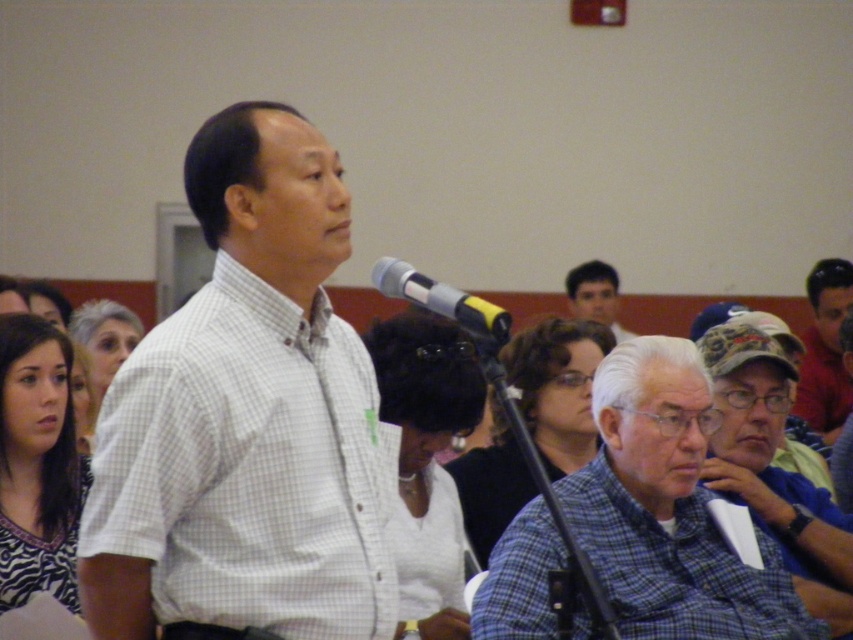
Is zebra print shirt at lower left positioned before smooth black hair at upper center?

Yes, it is in front of smooth black hair at upper center.

From the picture: Who is shorter, zebra print shirt at lower left or smooth black hair at upper center?

smooth black hair at upper center is shorter.

The height and width of the screenshot is (640, 853). I want to click on zebra print shirt at lower left, so click(38, 465).

The image size is (853, 640). Describe the element at coordinates (558, 387) in the screenshot. I see `blue plaid shirt at center` at that location.

Is blue plaid shirt at center closer to the viewer compared to silver metallic microphone at center?

No, blue plaid shirt at center is behind silver metallic microphone at center.

This screenshot has height=640, width=853. What are the coordinates of `blue plaid shirt at center` in the screenshot? It's located at (558, 387).

Identify the location of blue plaid shirt at center. The image size is (853, 640). (558, 387).

Between silver metallic microphone at center and smooth black hair at upper center, which one has less height?

silver metallic microphone at center

Consider the image. Does silver metallic microphone at center appear on the right side of smooth black hair at upper center?

Incorrect, silver metallic microphone at center is not on the right side of smooth black hair at upper center.

Which is in front, point (389, 282) or point (578, 289)?

Point (389, 282) is in front.

You are a GUI agent. You are given a task and a screenshot of the screen. Output one action in this format:
    pyautogui.click(x=<x>, y=<y>)
    Task: Click on the silver metallic microphone at center
    
    Given the screenshot: What is the action you would take?
    pyautogui.click(x=444, y=301)